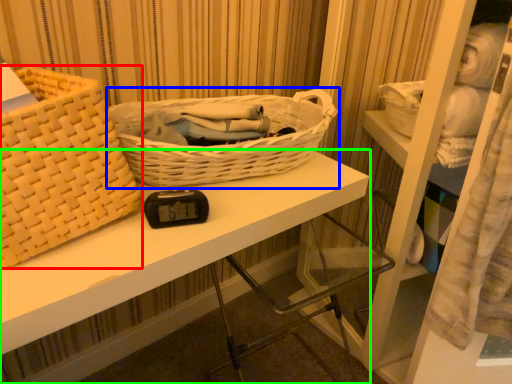
Question: Which is farther away from picnic basket (highlighted by a red box)? picnic basket (highlighted by a blue box) or desk (highlighted by a green box)?

Choices:
 (A) picnic basket
 (B) desk

Answer: (A)